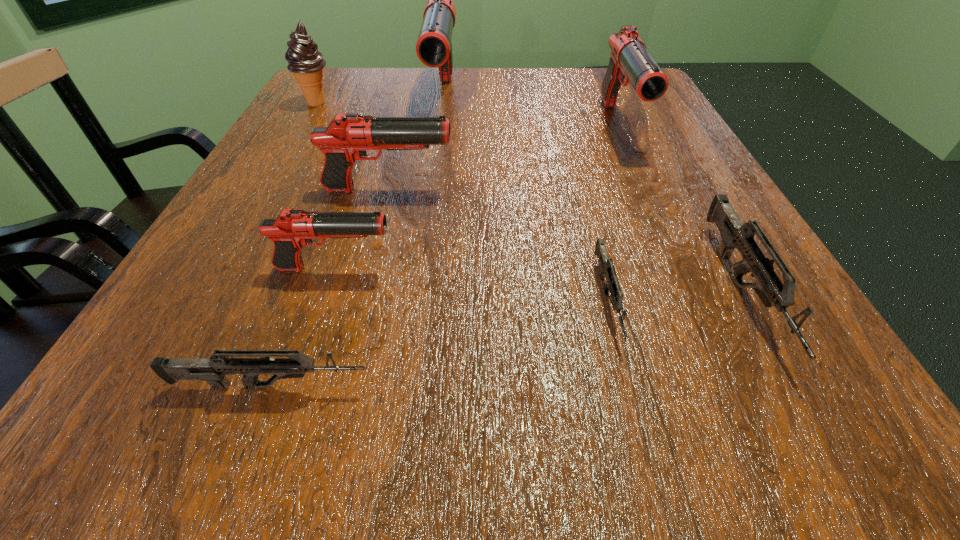
At what (x,y) coordinates should I click in order to perform the action: click on the rightmost object. Please return your answer as a coordinate pair (x, y). The image size is (960, 540). Looking at the image, I should click on (735, 234).

This screenshot has height=540, width=960. In order to click on the leftmost grey gun in this screenshot , I will do `click(213, 370)`.

Identify the location of the sixth tallest gun. (213, 370).

Find the location of a particular element. the second grey gun from left to right is located at coordinates (607, 269).

Where is `the fifth gun from left to right`? This screenshot has height=540, width=960. the fifth gun from left to right is located at coordinates (607, 269).

Where is `vacant space located at the aiming end of the tallest object`? The width and height of the screenshot is (960, 540). vacant space located at the aiming end of the tallest object is located at coordinates (434, 176).

I want to click on vacant space situated 0.400m at the aiming end of the rightmost black gun, so click(x=714, y=339).

The image size is (960, 540). I want to click on vacant region located 0.100m on the back of the icecream, so click(x=332, y=77).

Find the location of a particular element. free region located 0.370m at the aiming end of the second smallest black gun is located at coordinates (673, 190).

You are a GUI agent. You are given a task and a screenshot of the screen. Output one action in this format:
    pyautogui.click(x=<x>, y=<y>)
    Task: Click on the vacant area located at the aiming end of the fifth tallest object
    The image size is (960, 540).
    Given the screenshot: What is the action you would take?
    pyautogui.click(x=516, y=268)